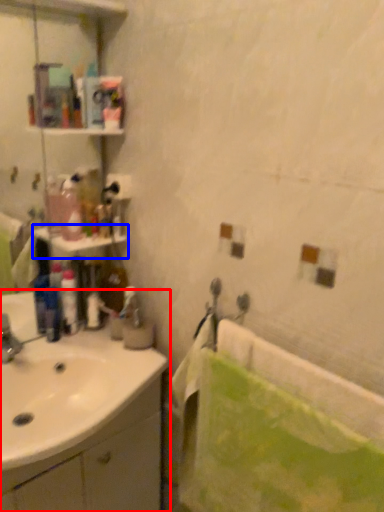
Question: Among these objects, which one is farthest to the camera, sink (highlighted by a red box) or shelf (highlighted by a blue box)?

Choices:
 (A) sink
 (B) shelf

Answer: (B)